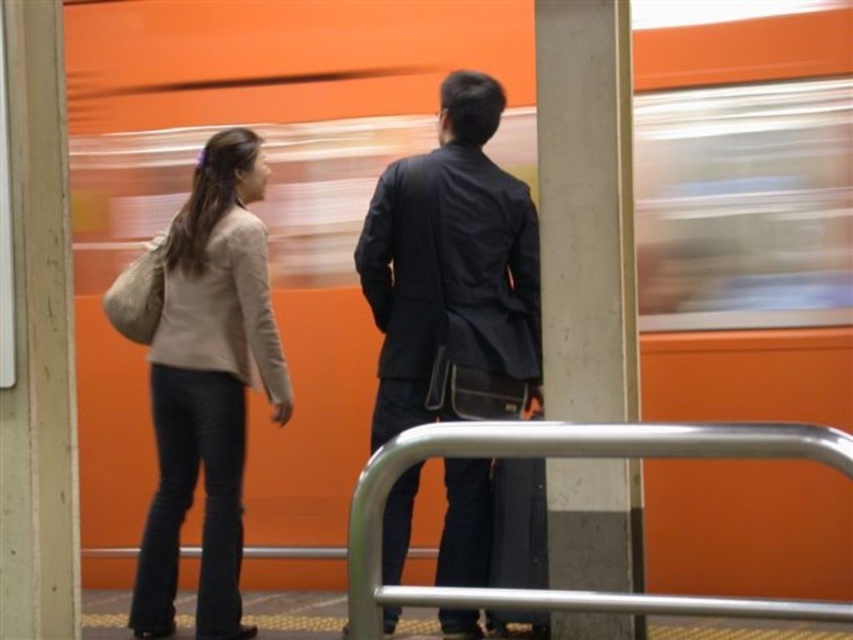
Question: Does matte black jacket at center appear over beige fabric sweater at left?

Choices:
 (A) yes
 (B) no

Answer: (A)

Question: Which point is farther to the camera?

Choices:
 (A) silver metallic rail at center
 (B) beige fabric sweater at left
 (C) concrete at center
 (D) matte black jacket at center

Answer: (B)

Question: Which of the following is the closest to the observer?

Choices:
 (A) (846, 451)
 (B) (602, 13)
 (C) (457, 257)

Answer: (A)

Question: Among these points, which one is farthest from the camera?

Choices:
 (A) (619, 614)
 (B) (422, 259)

Answer: (B)

Question: Does matte black jacket at center have a lesser width compared to beige fabric sweater at left?

Choices:
 (A) no
 (B) yes

Answer: (A)

Question: Can you confirm if matte black jacket at center is positioned above concrete at center?

Choices:
 (A) no
 (B) yes

Answer: (A)